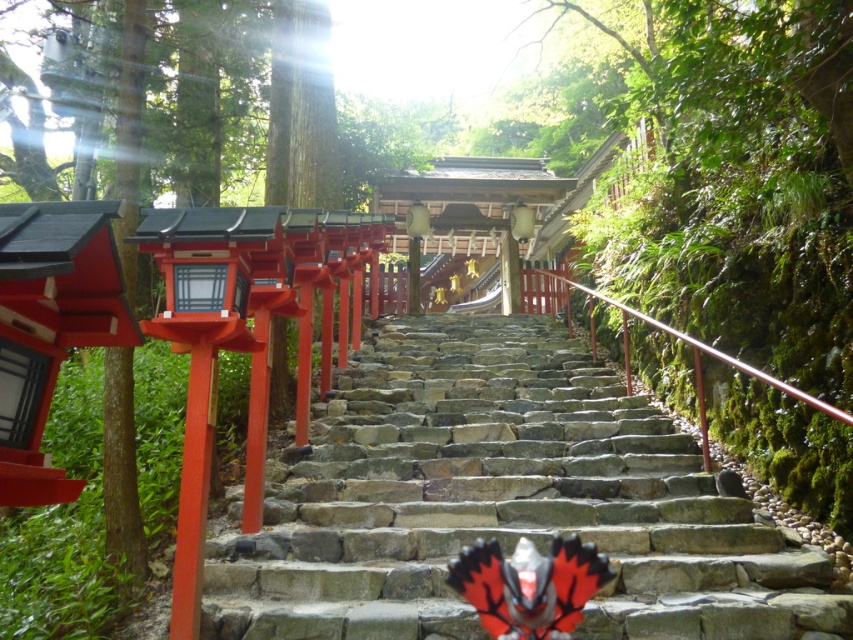
Based on the photo, you are a visitor at the shrine and want to place a small offering on the stone at center. However, there is a matte black lantern at center nearby. Based on their positions, which object is closer to your right hand if you are facing the shrine?

The stone at center is to the right of the matte black lantern at center, so if you are facing the shrine, the stone at center would be closer to your right hand.

You are a visitor at the shrine and want to hang a new lantern between the two existing lanterns, the matte white lantern at upper center and the matte black lantern at center. Which lantern should you place the new lantern closer to if you want it to be visually balanced with the existing ones?

Since the matte white lantern at upper center is wider than the matte black lantern at center, placing the new lantern closer to the matte black lantern at center would help maintain visual balance between the two existing lanterns.

You are standing at the base of the stone steps leading to the shrine. There are two points marked on the path ahead of you. One is at coordinates point (515, 240) and the other is at point (427, 225). Which point is closer to you as you face the shrine?

Point (515, 240) is closer to you because it is further to the viewer than point (427, 225), meaning it is nearer in the scene.